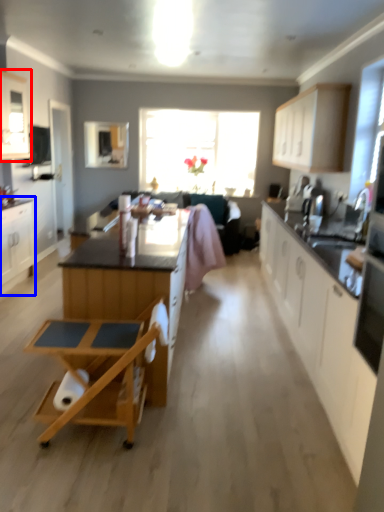
Question: Among these objects, which one is nearest to the camera, cabinetry (highlighted by a red box) or cabinetry (highlighted by a blue box)?

Choices:
 (A) cabinetry
 (B) cabinetry

Answer: (A)